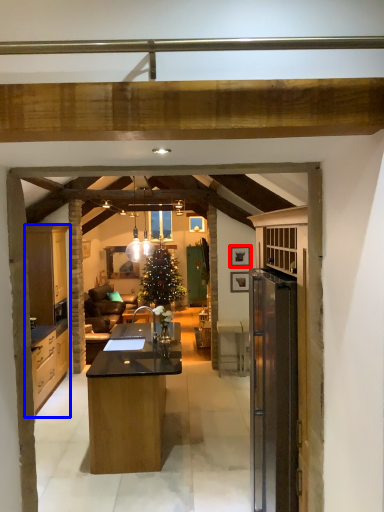
Question: Which point is further to the camera, picture frame (highlighted by a red box) or cabinetry (highlighted by a blue box)?

Choices:
 (A) picture frame
 (B) cabinetry

Answer: (A)